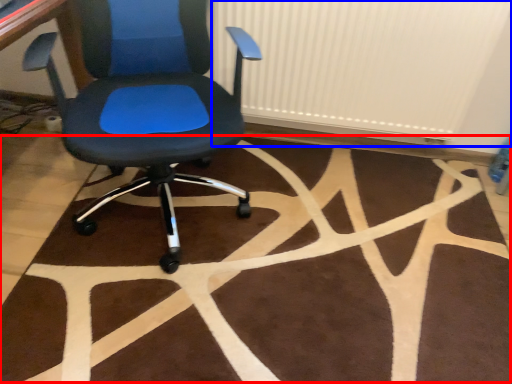
Question: Which object is further to the camera taking this photo, mat (highlighted by a red box) or radiator (highlighted by a blue box)?

Choices:
 (A) mat
 (B) radiator

Answer: (B)